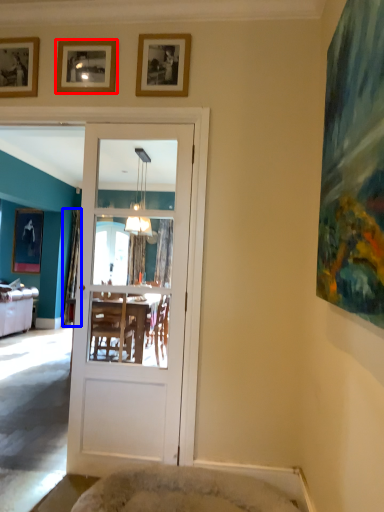
Question: Which object is further to the camera taking this photo, picture frame (highlighted by a red box) or curtain (highlighted by a blue box)?

Choices:
 (A) picture frame
 (B) curtain

Answer: (B)